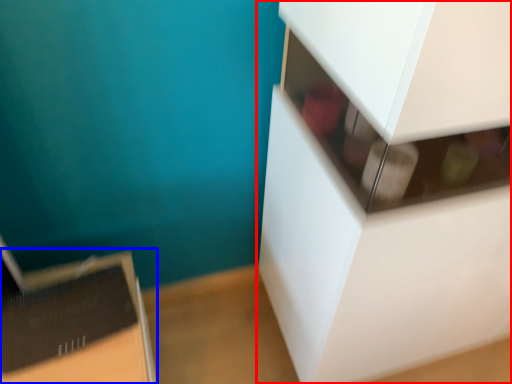
Question: Among these objects, which one is nearest to the camera, furniture (highlighted by a red box) or cardboard box (highlighted by a blue box)?

Choices:
 (A) furniture
 (B) cardboard box

Answer: (A)